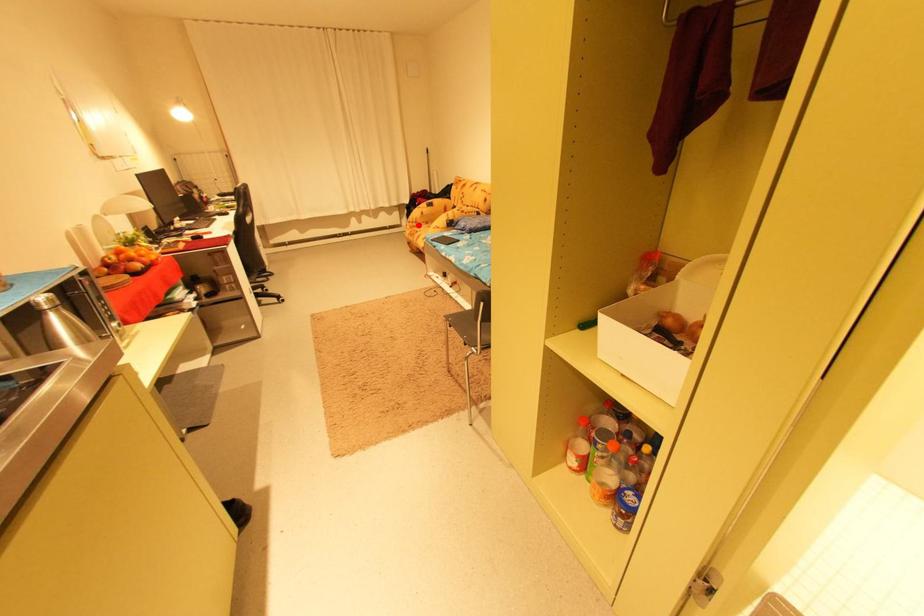
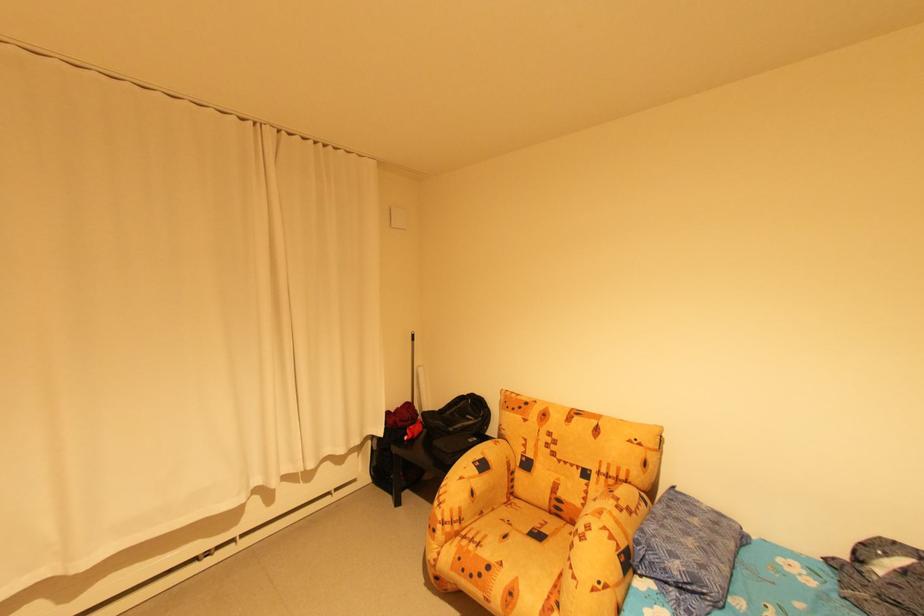
Question: I am providing you with two images of the same scene from different viewpoints. A red point is marked on the first image. Can you still see the location of the red point in image 2?

Choices:
 (A) Yes
 (B) No

Answer: (A)